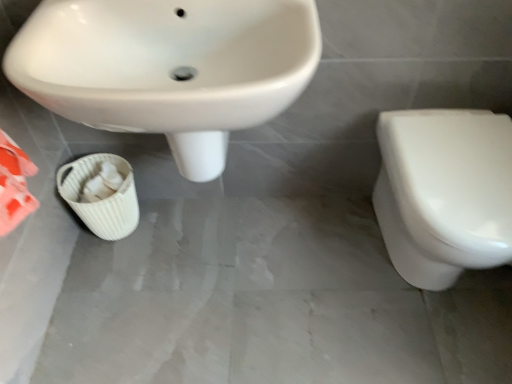
This screenshot has height=384, width=512. I want to click on vacant area that lies to the right of white woven basket at lower left, so click(176, 229).